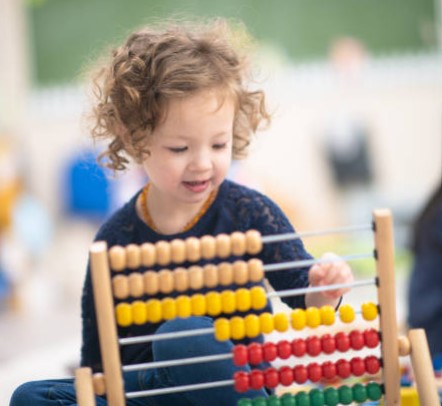
The width and height of the screenshot is (442, 406). Identify the location of abacus bead in fifth row down. (238, 354), (257, 354), (270, 353), (284, 349), (300, 346), (313, 346), (332, 344), (343, 342), (355, 338), (369, 338).